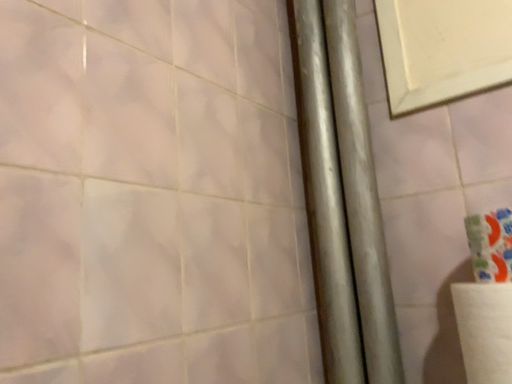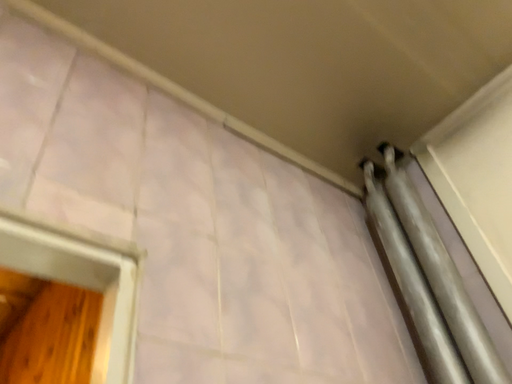
Question: Which way did the camera rotate in the video?

Choices:
 (A) rotated downward
 (B) rotated upward

Answer: (B)